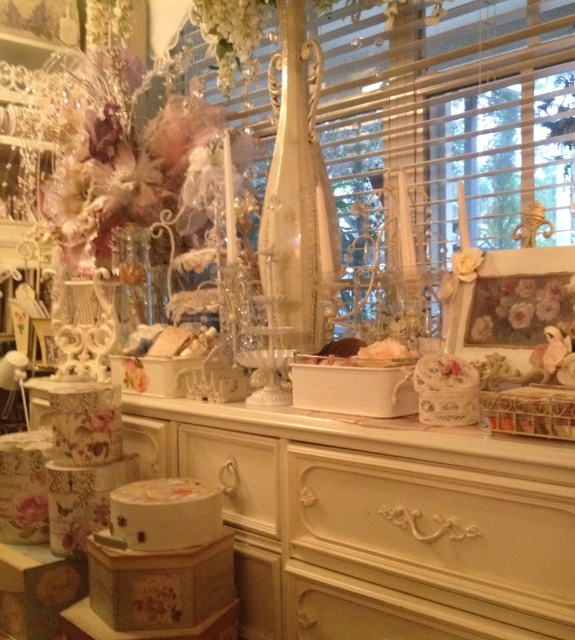
Does point (270, 506) come farther from viewer compared to point (561, 280)?

Yes, point (270, 506) is farther from viewer.

The height and width of the screenshot is (640, 575). Find the location of `white wood drawer at center`. white wood drawer at center is located at coordinates (235, 472).

Which of these two, white wood drawer at center or floral-patterned fabric at lower left, stands taller?

white wood drawer at center

Between point (254, 509) and point (41, 499), which one is positioned behind?

The point (41, 499) is behind.

Is point (253, 515) positioned behind point (25, 500)?

No, it is not.

The image size is (575, 640). In order to click on white wood drawer at center in this screenshot , I will do `click(235, 472)`.

Is metallic gold vase at center wider than floral-patterned fabric at lower left?

Correct, the width of metallic gold vase at center exceeds that of floral-patterned fabric at lower left.

Who is more distant from viewer, (x=424, y=182) or (x=18, y=500)?

The point (x=424, y=182) is more distant.

The image size is (575, 640). Find the location of `metallic gold vase at center`. metallic gold vase at center is located at coordinates (450, 116).